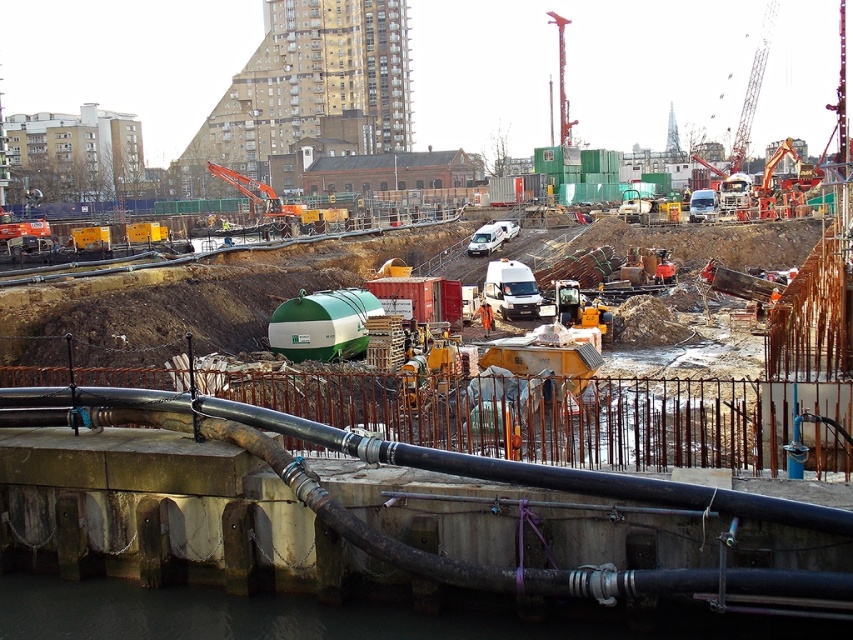
You are a construction worker who needs to move a heavy load from the yellow metallic train track at center to the red metal crane at upper center. Which object is located above the other to determine the best lifting path?

The red metal crane at upper center is positioned above the yellow metallic train track at center, so the crane can lower its hook down to the train track to lift the load.

You are a construction worker standing at the edge of the construction site. You need to place a new safety sign between the point at coordinates point (x=165, y=264) and the point at coordinates point (x=560, y=109). Since you want the sign to be as visible as possible to workers approaching from the front, which point should the sign be placed closer to?

The sign should be placed closer to point (x=165, y=264) because it is closer to the viewer, making it more visible to workers approaching from the front.

You are a construction worker who needs to transport the green matte tank at center and the metallic orange crane at upper right through a narrow alleyway that can only accommodate items up to the width of the thinner object. Which object should you prioritize transporting first?

The green matte tank at center is thinner than the metallic orange crane at upper right, so you should prioritize transporting the green matte tank at center first since it will fit through the narrow alleyway.